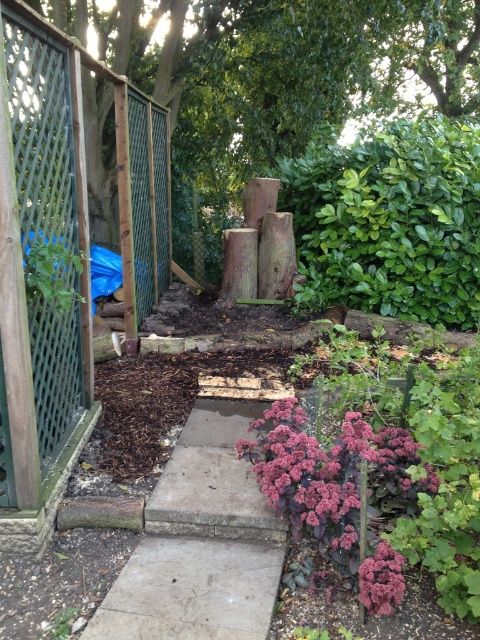
Can you confirm if green lattice fence at left is shorter than purple matte flower at lower right?

No.

Does green lattice fence at left appear over purple matte flower at lower right?

Indeed, green lattice fence at left is positioned over purple matte flower at lower right.

Does point (24, 6) lie in front of point (287, 486)?

That is True.

I want to click on green lattice fence at left, so click(x=63, y=243).

Between green lattice fence at left and purple matte flower at lower center, which one appears on the left side from the viewer's perspective?

From the viewer's perspective, green lattice fence at left appears more on the left side.

Which is behind, point (21, 269) or point (369, 602)?

The point (21, 269) is more distant.

What do you see at coordinates (63, 243) in the screenshot? I see `green lattice fence at left` at bounding box center [63, 243].

Find the location of a particular element. green lattice fence at left is located at coordinates (63, 243).

Between green lattice fence at left and smooth concrete path at center, which one is positioned higher?

green lattice fence at left

Who is more forward, [147,218] or [269,593]?

Point [269,593]

Who is more distant from viewer, (52, 236) or (272, 595)?

The point (52, 236) is behind.

Find the location of a particular element. green lattice fence at left is located at coordinates (63, 243).